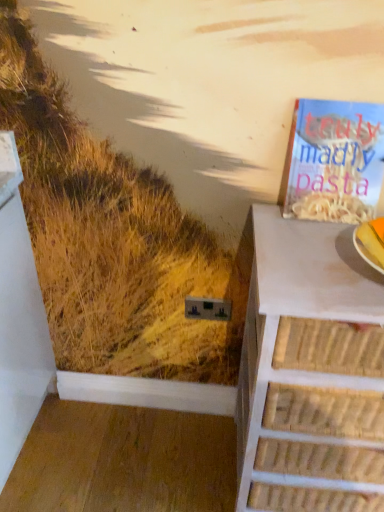
The image size is (384, 512). What are the coordinates of `free space in front of matte paper book at upper right` in the screenshot? It's located at (314, 244).